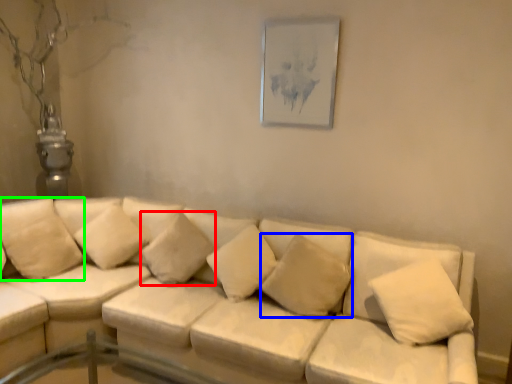
Question: Based on their relative distances, which object is nearer to pillow (highlighted by a red box)? Choose from pillow (highlighted by a blue box) and pillow (highlighted by a green box).

Choices:
 (A) pillow
 (B) pillow

Answer: (A)